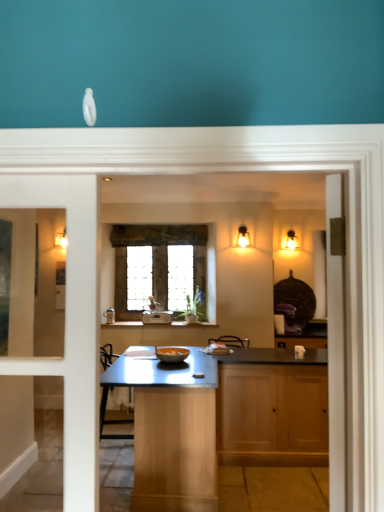
Question: Considering the relative sizes of stained glass window at center and matte gold sconce at upper right, positioned as the 1th light fixture in right-to-left order, in the image provided, is stained glass window at center shorter than matte gold sconce at upper right, positioned as the 1th light fixture in right-to-left order,?

Choices:
 (A) no
 (B) yes

Answer: (A)

Question: Does stained glass window at center have a lesser width compared to matte gold sconce at upper right, placed as the 2th light fixture when sorted from left to right?

Choices:
 (A) yes
 (B) no

Answer: (A)

Question: Considering the relative positions of stained glass window at center and matte gold sconce at upper right, placed as the second light fixture when sorted from front to back, in the image provided, is stained glass window at center to the right of matte gold sconce at upper right, placed as the second light fixture when sorted from front to back, from the viewer's perspective?

Choices:
 (A) yes
 (B) no

Answer: (B)

Question: Is stained glass window at center surrounding matte gold sconce at upper right, which is the first light fixture from back to front?

Choices:
 (A) no
 (B) yes

Answer: (A)

Question: Considering the relative sizes of stained glass window at center and matte gold sconce at upper right, placed as the second light fixture when sorted from front to back, in the image provided, is stained glass window at center taller than matte gold sconce at upper right, placed as the second light fixture when sorted from front to back,?

Choices:
 (A) no
 (B) yes

Answer: (B)

Question: Can you see stained glass window at center touching matte gold sconce at upper right, placed as the second light fixture when sorted from front to back?

Choices:
 (A) yes
 (B) no

Answer: (B)

Question: Would you say stained glass window at center contains wooden cabinet at center?

Choices:
 (A) no
 (B) yes

Answer: (A)

Question: Is stained glass window at center next to wooden cabinet at center?

Choices:
 (A) yes
 (B) no

Answer: (B)

Question: Is stained glass window at center facing away from wooden cabinet at center?

Choices:
 (A) yes
 (B) no

Answer: (B)

Question: Is stained glass window at center shorter than wooden cabinet at center?

Choices:
 (A) no
 (B) yes

Answer: (A)

Question: Is stained glass window at center at the right side of wooden cabinet at center?

Choices:
 (A) yes
 (B) no

Answer: (B)

Question: Considering the relative sizes of stained glass window at center and wooden cabinet at center in the image provided, is stained glass window at center bigger than wooden cabinet at center?

Choices:
 (A) yes
 (B) no

Answer: (B)

Question: Is matte gold sconce at upper right, placed as the second light fixture when sorted from front to back, closer to camera compared to stained glass window at center?

Choices:
 (A) no
 (B) yes

Answer: (A)